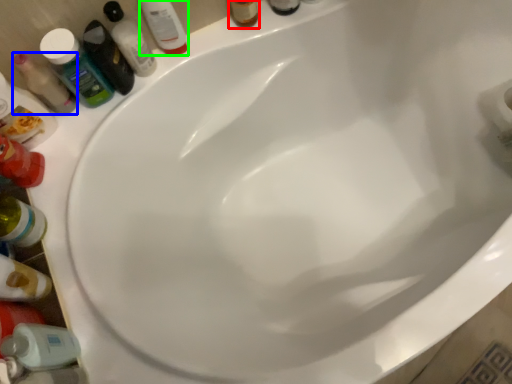
Question: Estimate the real-world distances between objects in this image. Which object is closer to toiletry (highlighted by a red box), mouthwash (highlighted by a blue box) or mouthwash (highlighted by a green box)?

Choices:
 (A) mouthwash
 (B) mouthwash

Answer: (B)